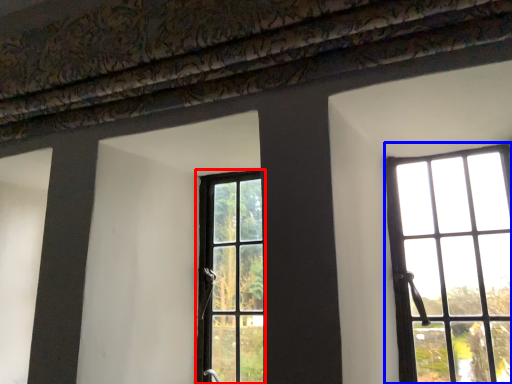
Question: Among these objects, which one is farthest to the camera, window (highlighted by a red box) or window (highlighted by a blue box)?

Choices:
 (A) window
 (B) window

Answer: (A)